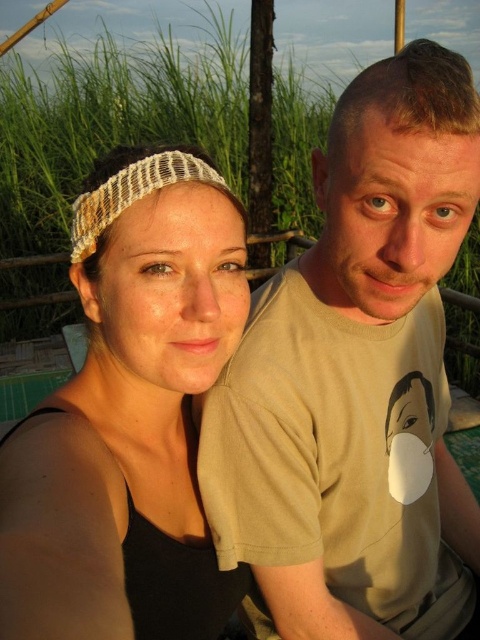
Question: Which of the following is the farthest from the observer?

Choices:
 (A) (409, 257)
 (B) (76, 524)

Answer: (A)

Question: In this image, where is matte beige t-shirt at right located relative to matte woven headband at center?

Choices:
 (A) below
 (B) above

Answer: (A)

Question: Which of the following is the farthest from the observer?

Choices:
 (A) matte woven headband at center
 (B) matte beige t-shirt at right

Answer: (B)

Question: Is matte beige t-shirt at right bigger than matte woven headband at center?

Choices:
 (A) yes
 (B) no

Answer: (A)

Question: Can you confirm if matte beige t-shirt at right is positioned to the right of matte woven headband at center?

Choices:
 (A) yes
 (B) no

Answer: (A)